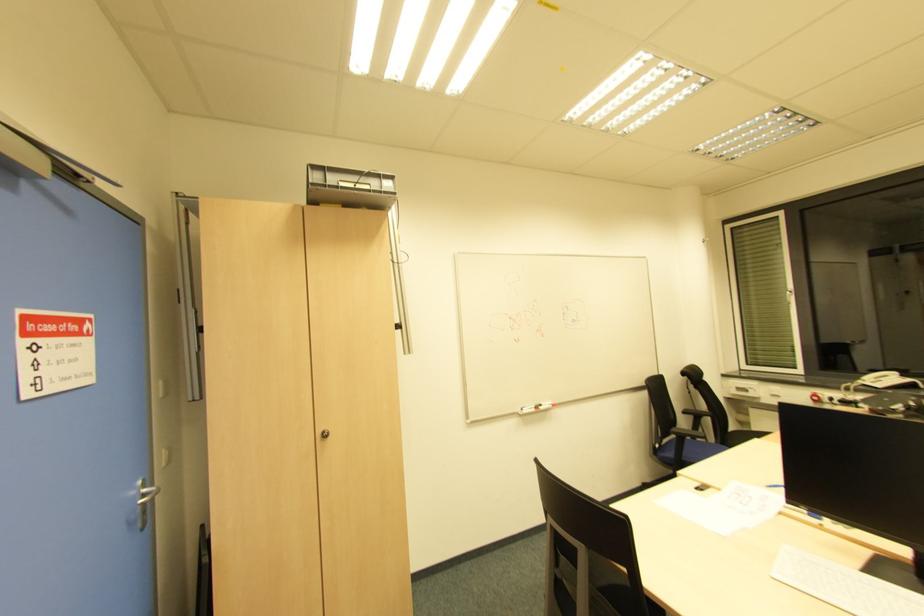
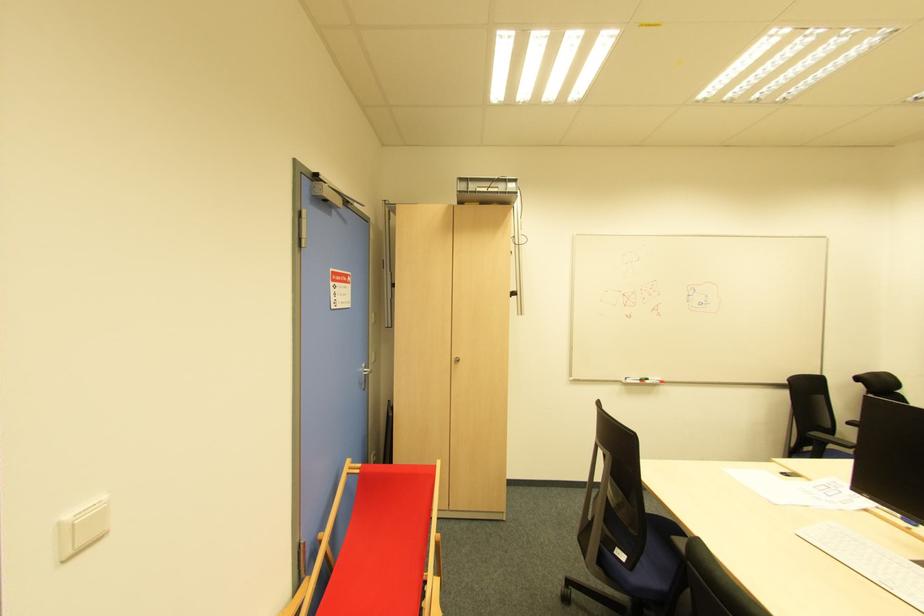
The point at (553,407) is marked in the first image. Where is the corresponding point in the second image?

(662, 383)